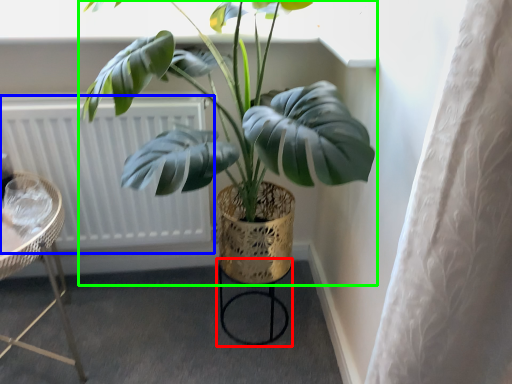
Question: Estimate the real-world distances between objects in this image. Which object is closer to bar stool (highlighted by a red box), radiator (highlighted by a blue box) or houseplant (highlighted by a green box)?

Choices:
 (A) radiator
 (B) houseplant

Answer: (A)